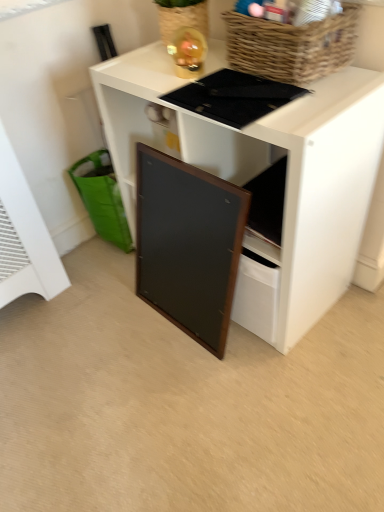
Question: Looking at their shapes, would you say green fabric shopping basket at lower left is wider or thinner than black matte board at center?

Choices:
 (A) thin
 (B) wide

Answer: (A)

Question: From a real-world perspective, relative to black matte board at center, is green fabric shopping basket at lower left vertically above or below?

Choices:
 (A) below
 (B) above

Answer: (A)

Question: Based on their relative distances, which object is nearer to the green fabric shopping basket at lower left?

Choices:
 (A) woven brown basket at upper right
 (B) black matte board at center
 (C) wooden framed board at center

Answer: (C)

Question: Considering the real-world distances, which object is closest to the green fabric shopping basket at lower left?

Choices:
 (A) wooden framed board at center
 (B) black matte board at center
 (C) woven brown basket at upper right

Answer: (A)